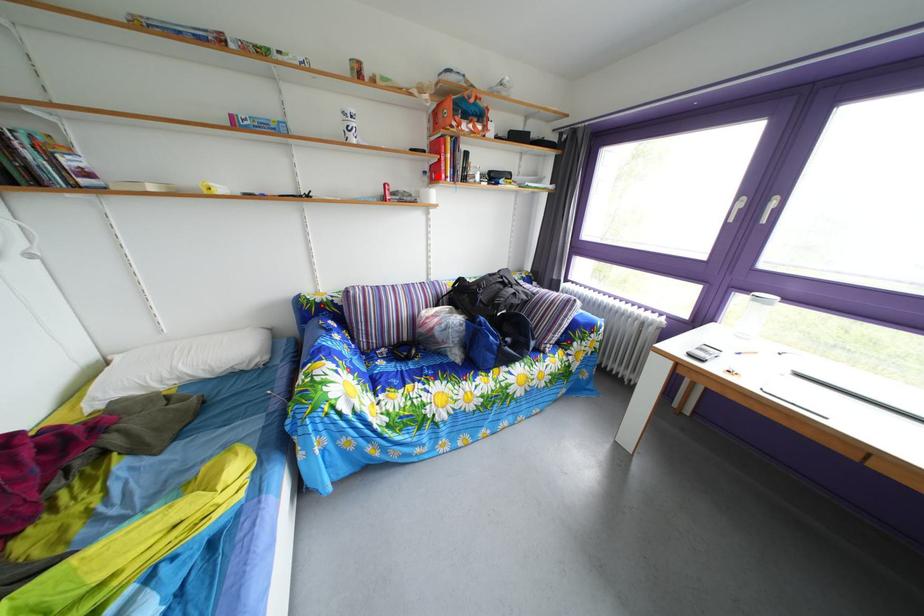
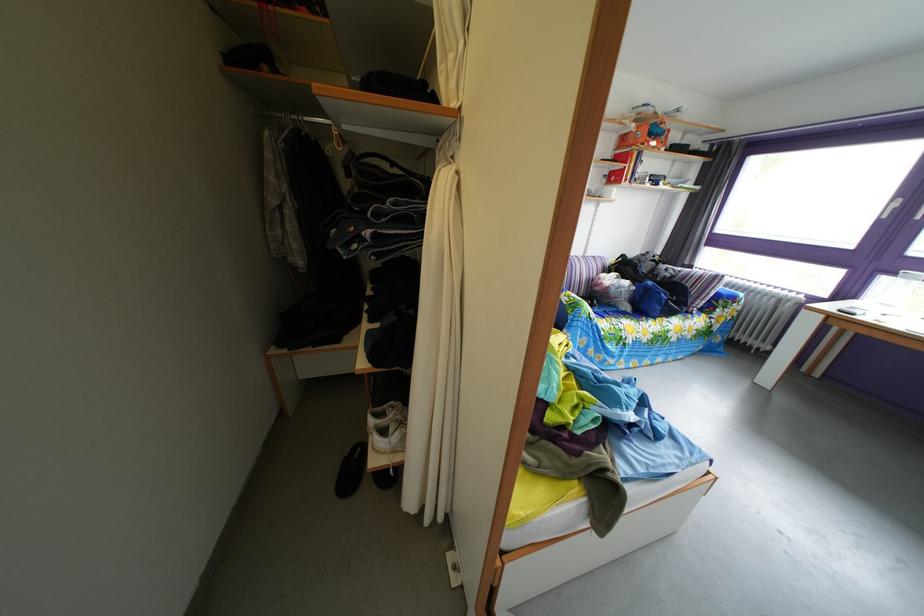
Where in the second image is the point corresponding to the highlighted location from the first image?

(618, 180)